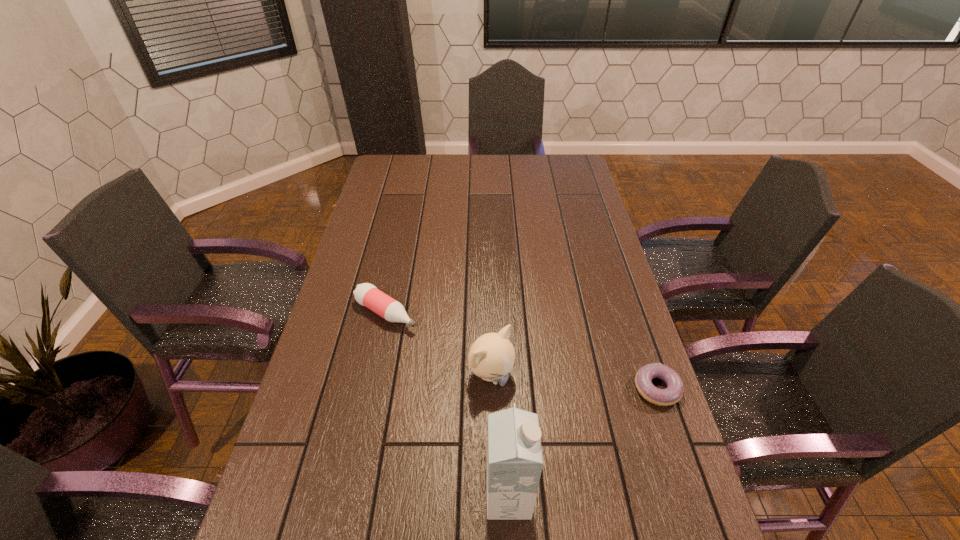
Find the location of a particular element. The image size is (960, 540). the nearest object is located at coordinates (514, 455).

You are a GUI agent. You are given a task and a screenshot of the screen. Output one action in this format:
    pyautogui.click(x=<x>, y=<y>)
    Task: Click on the carton
    
    Given the screenshot: What is the action you would take?
    pyautogui.click(x=514, y=455)

Locate an element on the screen. The height and width of the screenshot is (540, 960). doughnut is located at coordinates (673, 393).

At what (x,y) coordinates should I click in order to perform the action: click on the shortest object. Please return your answer as a coordinate pair (x, y). The height and width of the screenshot is (540, 960). Looking at the image, I should click on (673, 393).

Where is `the second shortest object`? The width and height of the screenshot is (960, 540). the second shortest object is located at coordinates [366, 294].

Identify the location of bottle. The image size is (960, 540). (366, 294).

Where is `kitten`? This screenshot has width=960, height=540. kitten is located at coordinates (492, 356).

At what (x,y) coordinates should I click in order to perform the action: click on blank space located 0.320m on the front label of the nearest object. Please return your answer as a coordinate pair (x, y). Looking at the image, I should click on (682, 497).

I want to click on vacant space situated 0.060m on the back of the doughnut, so click(x=644, y=351).

Find the location of a particular element. free space located with the cap open on the third tallest object is located at coordinates (517, 394).